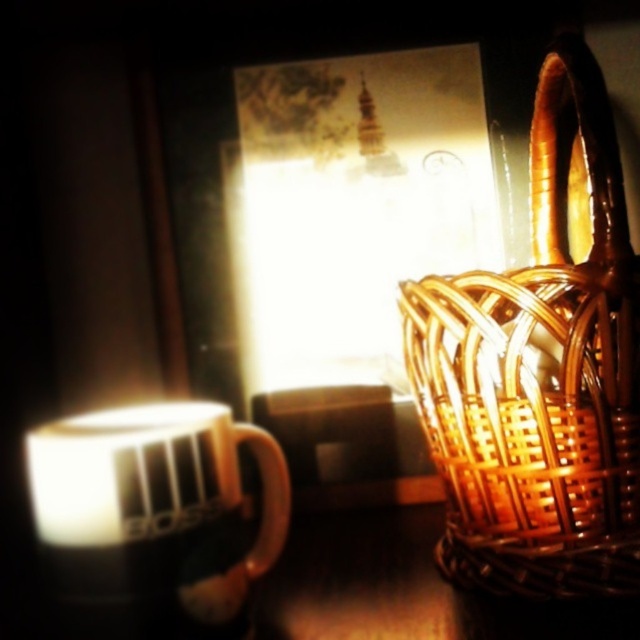
Question: Is brown woven basket at right thinner than white glossy mug at left?

Choices:
 (A) no
 (B) yes

Answer: (B)

Question: Observing the image, what is the correct spatial positioning of brown woven basket at right in reference to white glossy mug at left?

Choices:
 (A) above
 (B) below

Answer: (A)

Question: Is brown woven basket at right thinner than white glossy mug at left?

Choices:
 (A) yes
 (B) no

Answer: (A)